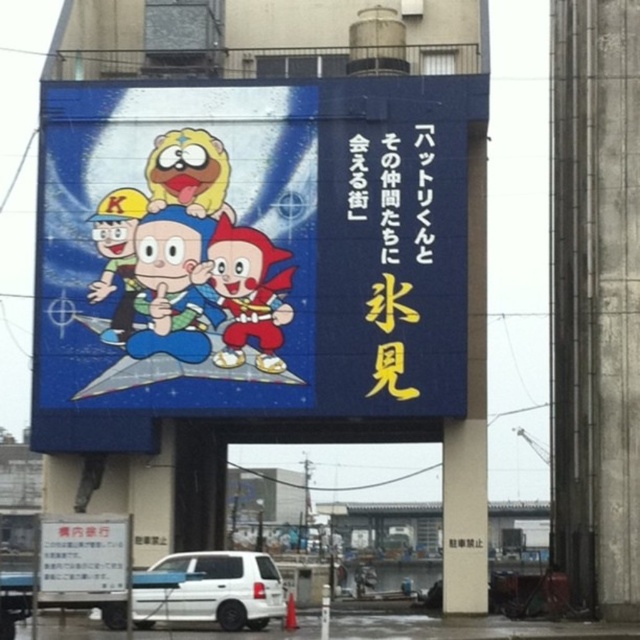
Does matte blue suit at center have a smaller size compared to shiny red helmet at center?

Actually, matte blue suit at center might be larger than shiny red helmet at center.

Measure the distance from matte blue suit at center to shiny red helmet at center.

9.97 feet

Find the location of a particular element. This screenshot has width=640, height=640. matte blue suit at center is located at coordinates (173, 285).

Where is `matte blue suit at center`? matte blue suit at center is located at coordinates (173, 285).

From the picture: Does cartoon characters at center have a greater height compared to shiny red helmet at center?

Correct, cartoon characters at center is much taller as shiny red helmet at center.

Does cartoon characters at center appear under shiny red helmet at center?

No, cartoon characters at center is not below shiny red helmet at center.

Is point (186, 227) positioned in front of point (260, 284)?

No, (186, 227) is behind (260, 284).

What are the coordinates of `cartoon characters at center` in the screenshot? It's located at (250, 252).

At what (x,y) coordinates should I click in order to perform the action: click on matte blue suit at center. Please return your answer as a coordinate pair (x, y). Looking at the image, I should click on (173, 285).

Who is taller, matte blue suit at center or white matte van at lower center?

With more height is matte blue suit at center.

Where is `matte blue suit at center`? This screenshot has height=640, width=640. matte blue suit at center is located at coordinates pos(173,285).